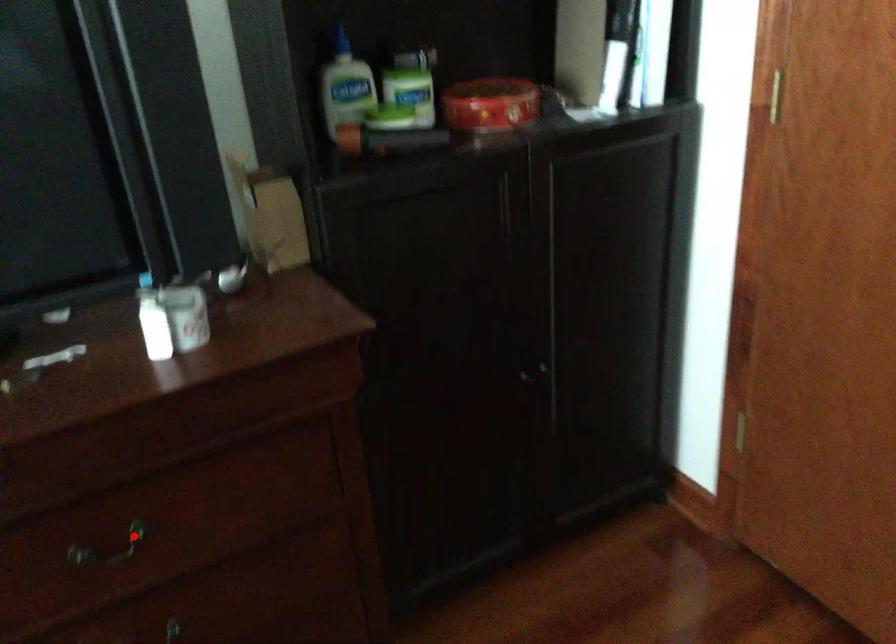
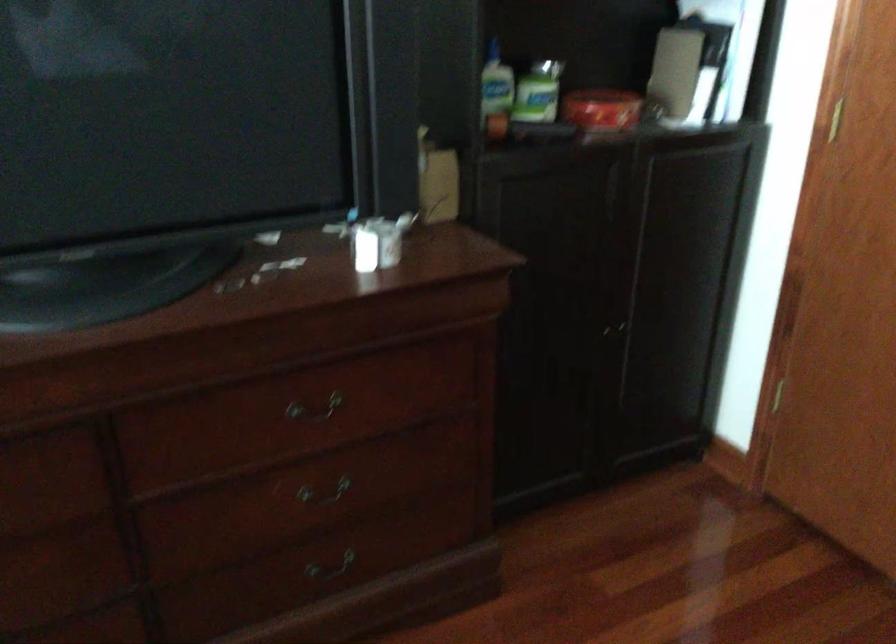
Find the pixel in the second image that matches the highlighted location in the first image.

(314, 409)